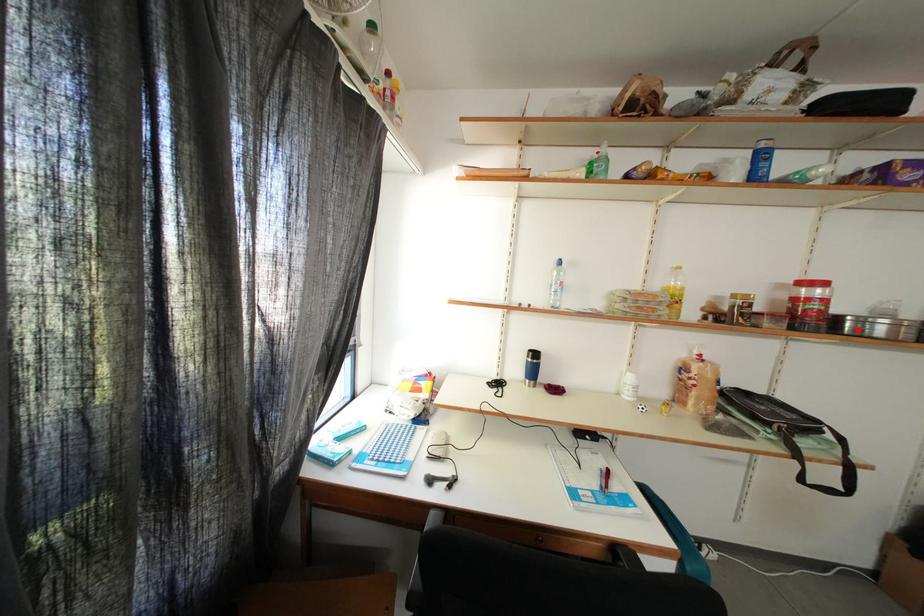
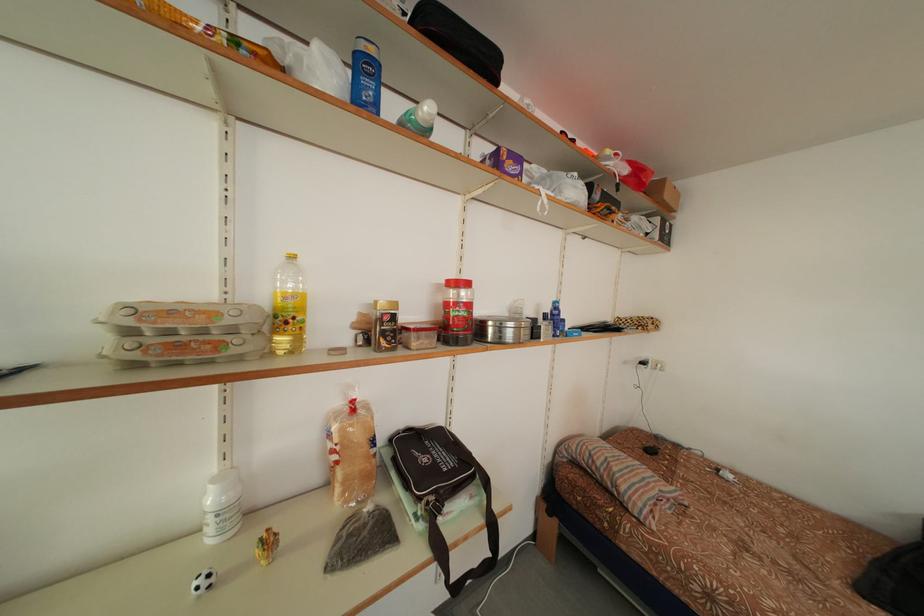
Where in the second image is the point corresponding to the highlighted location from the first image?

(499, 334)